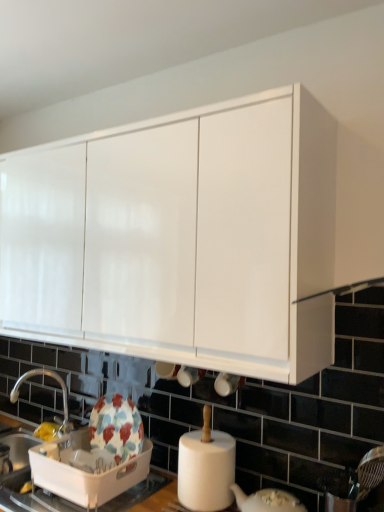
The image size is (384, 512). Describe the element at coordinates (181, 239) in the screenshot. I see `white glossy cabinet at upper center` at that location.

I want to click on silver metallic tap at lower left, so click(57, 382).

Describe the element at coordinates (57, 382) in the screenshot. This screenshot has height=512, width=384. I see `silver metallic tap at lower left` at that location.

Describe the element at coordinates (84, 471) in the screenshot. I see `floral ceramic dish drainer at lower left` at that location.

Find the location of a particular element. The height and width of the screenshot is (512, 384). white glossy cabinet at upper center is located at coordinates (181, 239).

Looking at this image, which object is positioned more to the left, floral ceramic dish drainer at lower left or white glossy cabinet at upper center?

Positioned to the left is white glossy cabinet at upper center.

Is floral ceramic dish drainer at lower left spatially inside white glossy cabinet at upper center, or outside of it?

floral ceramic dish drainer at lower left lies outside white glossy cabinet at upper center.

From a real-world perspective, which is physically below, floral ceramic dish drainer at lower left or white glossy cabinet at upper center?

In real-world perspective, floral ceramic dish drainer at lower left is lower.

Between floral ceramic dish drainer at lower left and white glossy cabinet at upper center, which one has less height?

With less height is floral ceramic dish drainer at lower left.

Considering the sizes of objects white glossy cabinet at upper center and silver metallic tap at lower left in the image provided, who is thinner, white glossy cabinet at upper center or silver metallic tap at lower left?

Thinner between the two is silver metallic tap at lower left.

Based on the photo, based on their sizes in the image, would you say white glossy cabinet at upper center is bigger or smaller than silver metallic tap at lower left?

In the image, white glossy cabinet at upper center appears to be larger than silver metallic tap at lower left.

How different are the orientations of white glossy cabinet at upper center and silver metallic tap at lower left in degrees?

54.3 degrees.

Looking at this image, how much distance is there between silver metallic tap at lower left and white glossy cabinet at upper center?

silver metallic tap at lower left is 3.51 feet from white glossy cabinet at upper center.

Considering the relative sizes of silver metallic tap at lower left and white glossy cabinet at upper center in the image provided, is silver metallic tap at lower left taller than white glossy cabinet at upper center?

No, silver metallic tap at lower left is not taller than white glossy cabinet at upper center.

From the picture: Considering the positions of objects silver metallic tap at lower left and white glossy cabinet at upper center in the image provided, who is more to the left, silver metallic tap at lower left or white glossy cabinet at upper center?

silver metallic tap at lower left is more to the left.

Considering their positions, is silver metallic tap at lower left located in front of or behind white glossy cabinet at upper center?

Clearly, silver metallic tap at lower left is behind white glossy cabinet at upper center.

Does white glossy cabinet at upper center have a lesser width compared to floral ceramic dish drainer at lower left?

No, white glossy cabinet at upper center is not thinner than floral ceramic dish drainer at lower left.

Which is closer to the camera, (x=233, y=206) or (x=115, y=470)?

The point (x=233, y=206) is in front.

In the scene shown: Is white glossy cabinet at upper center facing towards floral ceramic dish drainer at lower left?

No, white glossy cabinet at upper center does not turn towards floral ceramic dish drainer at lower left.

Considering the sizes of white glossy cabinet at upper center and floral ceramic dish drainer at lower left in the image, is white glossy cabinet at upper center taller or shorter than floral ceramic dish drainer at lower left?

Clearly, white glossy cabinet at upper center is taller compared to floral ceramic dish drainer at lower left.

Based on the photo, is the position of silver metallic tap at lower left less distant than that of floral ceramic dish drainer at lower left?

No, silver metallic tap at lower left is further to the viewer.

Are silver metallic tap at lower left and floral ceramic dish drainer at lower left located far from each other?

No, there isn't a large distance between silver metallic tap at lower left and floral ceramic dish drainer at lower left.

From the image's perspective, which one is positioned lower, silver metallic tap at lower left or floral ceramic dish drainer at lower left?

floral ceramic dish drainer at lower left, from the image's perspective.

Does silver metallic tap at lower left appear on the left side of floral ceramic dish drainer at lower left?

Correct, you'll find silver metallic tap at lower left to the left of floral ceramic dish drainer at lower left.

Does floral ceramic dish drainer at lower left lie behind silver metallic tap at lower left?

No, it is in front of silver metallic tap at lower left.

Is floral ceramic dish drainer at lower left bigger than silver metallic tap at lower left?

Indeed, floral ceramic dish drainer at lower left has a larger size compared to silver metallic tap at lower left.

Image resolution: width=384 pixels, height=512 pixels. Find the location of `tap on the left of floral ceramic dish drainer at lower left`. tap on the left of floral ceramic dish drainer at lower left is located at coordinates (57, 382).

Which of these two, floral ceramic dish drainer at lower left or silver metallic tap at lower left, is thinner?

floral ceramic dish drainer at lower left is thinner.

Where is `appliance below the white glossy cabinet at upper center (from the image's perspective)`? appliance below the white glossy cabinet at upper center (from the image's perspective) is located at coordinates (84, 471).

There is a silver metallic tap at lower left. Where is `cabinetry above it (from a real-world perspective)`? Image resolution: width=384 pixels, height=512 pixels. cabinetry above it (from a real-world perspective) is located at coordinates (181, 239).

Looking at the image, which one is located further to white glossy cabinet at upper center, silver metallic tap at lower left or floral ceramic dish drainer at lower left?

silver metallic tap at lower left lies further to white glossy cabinet at upper center than the other object.

Considering their positions, is white glossy cabinet at upper center positioned closer to floral ceramic dish drainer at lower left than silver metallic tap at lower left?

silver metallic tap at lower left.

Which object lies nearer to the anchor point silver metallic tap at lower left, floral ceramic dish drainer at lower left or white glossy cabinet at upper center?

floral ceramic dish drainer at lower left is closer to silver metallic tap at lower left.

When comparing their distances from white glossy cabinet at upper center, does floral ceramic dish drainer at lower left or silver metallic tap at lower left seem closer?

Among the two, floral ceramic dish drainer at lower left is located nearer to white glossy cabinet at upper center.

Considering their positions, is silver metallic tap at lower left positioned closer to floral ceramic dish drainer at lower left than white glossy cabinet at upper center?

The object closer to floral ceramic dish drainer at lower left is silver metallic tap at lower left.

Which object lies further to the anchor point silver metallic tap at lower left, white glossy cabinet at upper center or floral ceramic dish drainer at lower left?

white glossy cabinet at upper center is further to silver metallic tap at lower left.

Image resolution: width=384 pixels, height=512 pixels. What are the coordinates of `tap that lies between white glossy cabinet at upper center and floral ceramic dish drainer at lower left from top to bottom` in the screenshot? It's located at (57, 382).